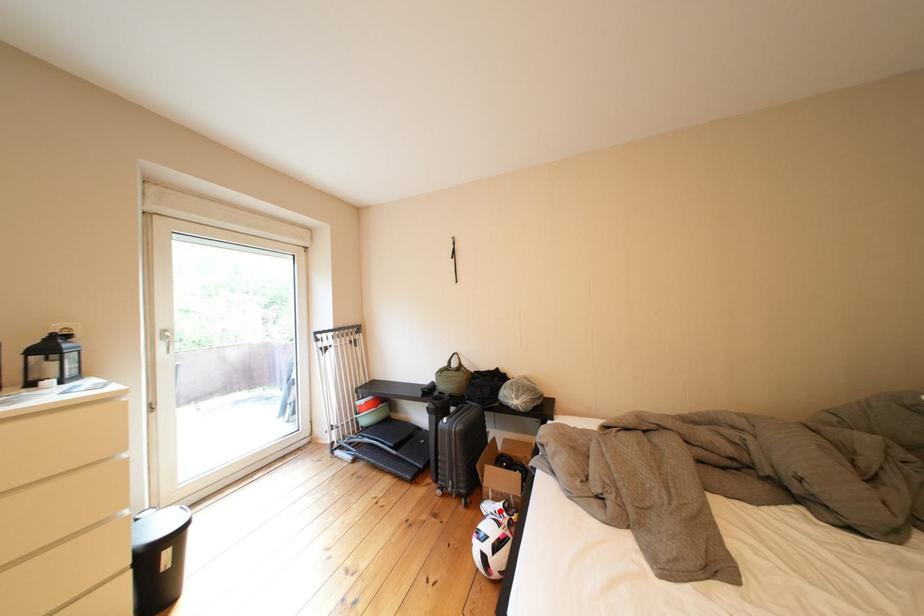
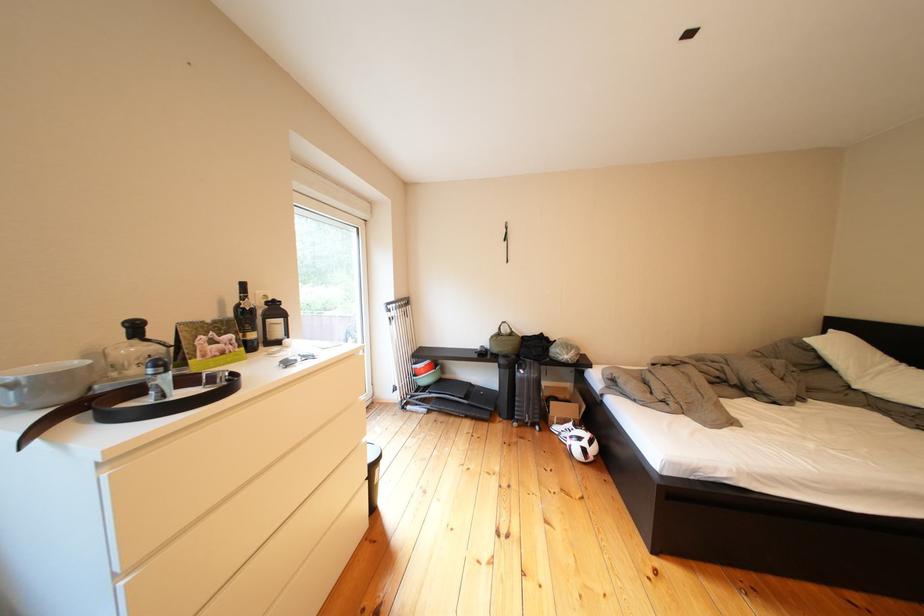
Question: I am providing you with two images of the same scene from different viewpoints. A red point is shown in image1. For the corresponding object point in image2, is it positioned nearer or farther from the camera?

Choices:
 (A) Nearer
 (B) Farther

Answer: (B)